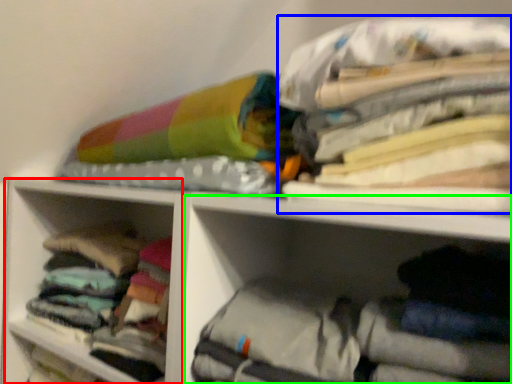
Question: Which object is positioned farthest from cabinet (highlighted by a red box)? Select from clothing (highlighted by a blue box) and cabinet (highlighted by a green box).

Choices:
 (A) clothing
 (B) cabinet

Answer: (A)